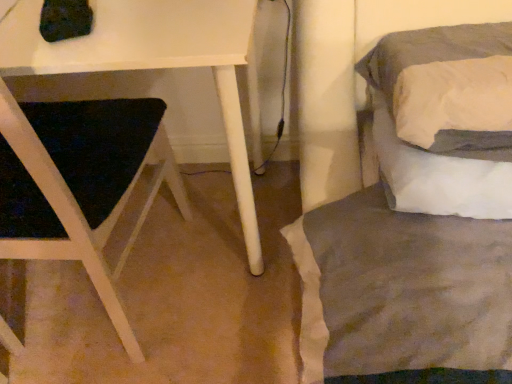
Identify the location of free area below white matte table at left (from a real-world perspective). The height and width of the screenshot is (384, 512). point(182,232).